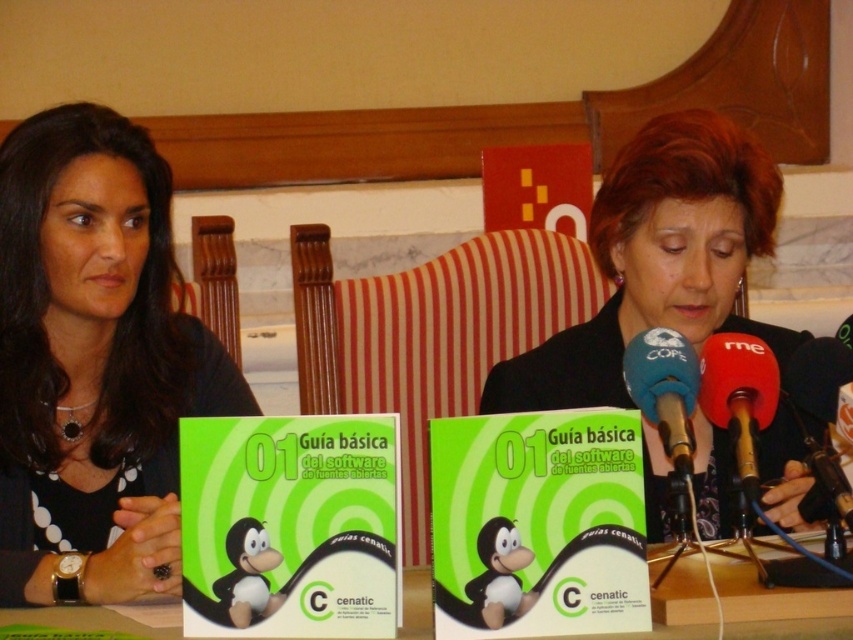
You are a photographer positioned behind the table at a press conference. You need to take a photo of both the matte black shirt at left and the black fabric jacket at center. Which object should you focus on first to ensure both are in frame?

You should focus on the matte black shirt at left first because it is closer to you than the black fabric jacket at center, ensuring both are in frame.

You are a photographer at the press conference and need to adjust your camera to focus on both the matte black shirt at left and the black fabric jacket at center. Which object should you focus on first to ensure proper focus, considering their heights?

The matte black shirt at left is taller than the black fabric jacket at center, so you should focus on the matte black shirt at left first to ensure proper focus.

You are a photographer trying to capture a closeup shot of the blue fabric microphone at center without including the matte black shirt at left in the frame. Given that your camera has a focal length of 50mm and a sensor size of 24x36mm, what is the minimum distance you need to be from the microphone to achieve this?

The matte black shirt at left and blue fabric microphone at center are 25.89 inches apart. Using the lens formula, the minimum distance required would be approximately 25.89 inches divided by the angle of view. With a 50mm lens on a full frame sensor, the horizontal angle of view is about 30 degrees. Calculating tan 15 degrees gives 0.2679, so the minimum distance is 25.89 inches divided by 0.2679, resulting in approximately 96.6 inches or 8.05 feet. Therefore, you need to be at least 8 feet away from the